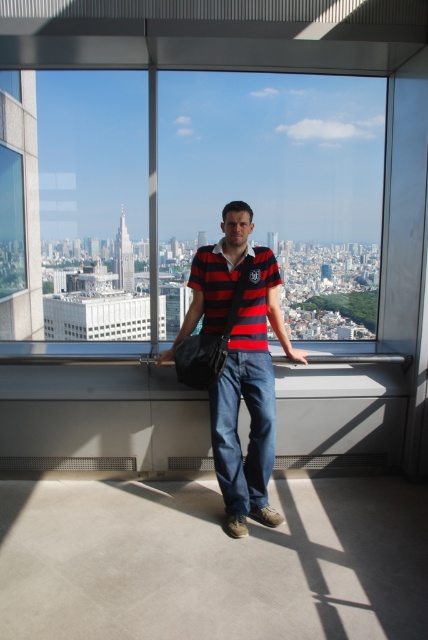
Who is more forward, (285, 144) or (275, 321)?

Positioned in front is point (275, 321).

Who is taller, transparent glass window at center or striped cotton shirt at center?

transparent glass window at center

Between point (169, 209) and point (249, 216), which one is positioned in front?

Point (249, 216)

This screenshot has height=640, width=428. Identify the location of transparent glass window at center. (190, 196).

Is the position of gray concrete ledge at center less distant than that of red striped polo shirt at center?

No, gray concrete ledge at center is further to the viewer.

Does gray concrete ledge at center lie behind red striped polo shirt at center?

Yes, gray concrete ledge at center is behind red striped polo shirt at center.

Is point (284, 435) closer to viewer compared to point (261, 259)?

No.

Identify the location of gray concrete ledge at center. This screenshot has height=640, width=428. (100, 417).

Which is above, striped cotton shirt at center or red striped polo shirt at center?

red striped polo shirt at center is above.

Which is behind, point (187, 330) or point (201, 282)?

The point (187, 330) is behind.

Identify the location of striped cotton shirt at center. (240, 364).